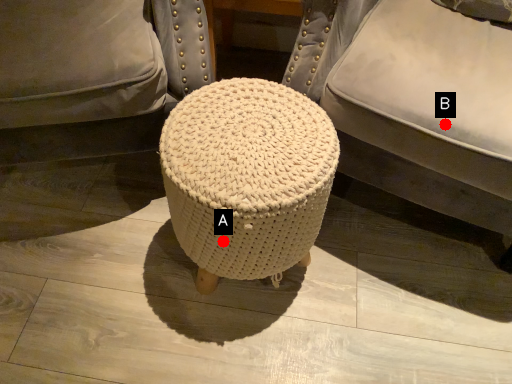
Question: Two points are circled on the image, labeled by A and B beside each circle. Which of the following is the farthest from the observer?

Choices:
 (A) A is further
 (B) B is further

Answer: (A)